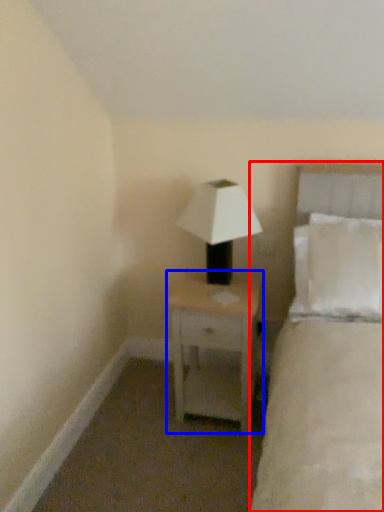
Question: Which object appears farthest to the camera in this image, bed (highlighted by a red box) or nightstand (highlighted by a blue box)?

Choices:
 (A) bed
 (B) nightstand

Answer: (B)